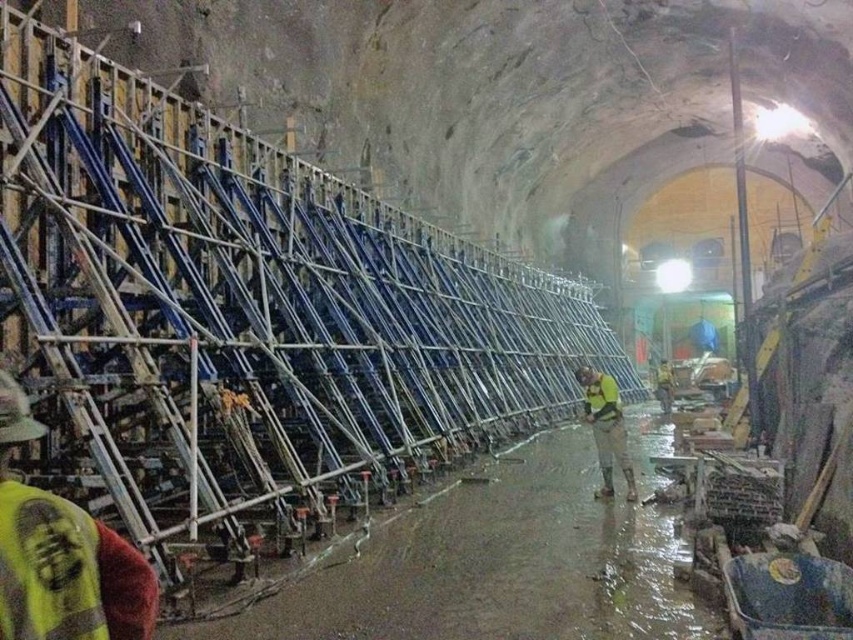
Question: Can you confirm if yellow reflective vest at left is smaller than yellow reflective safety vest at lower left?

Choices:
 (A) yes
 (B) no

Answer: (B)

Question: Can you confirm if yellow reflective vest at left is positioned to the right of yellow fabric safety vest at center?

Choices:
 (A) yes
 (B) no

Answer: (B)

Question: Which point is closer to the camera taking this photo?

Choices:
 (A) pos(97,536)
 (B) pos(585,403)

Answer: (A)

Question: Can you confirm if yellow reflective vest at left is bigger than yellow reflective vest at center?

Choices:
 (A) no
 (B) yes

Answer: (A)

Question: Which of the following is the farthest from the observer?

Choices:
 (A) yellow reflective vest at center
 (B) yellow fabric safety vest at center
 (C) yellow reflective safety vest at lower left
 (D) yellow reflective vest at left

Answer: (B)

Question: Among these points, which one is farthest from the camera?

Choices:
 (A) (601, 378)
 (B) (601, 376)

Answer: (B)